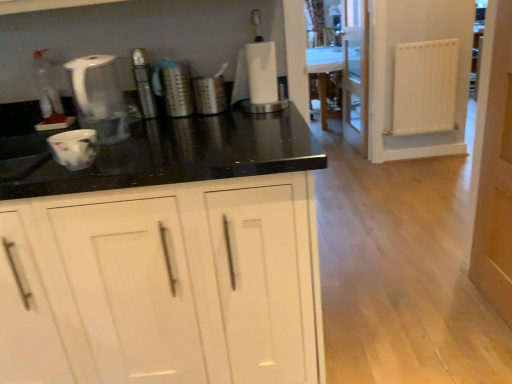
Find the location of a particular element. Image resolution: width=512 pixels, height=384 pixels. free space in front of metallic cylindrical at center, which is counted as the 4th appliance, starting from the right is located at coordinates (145, 118).